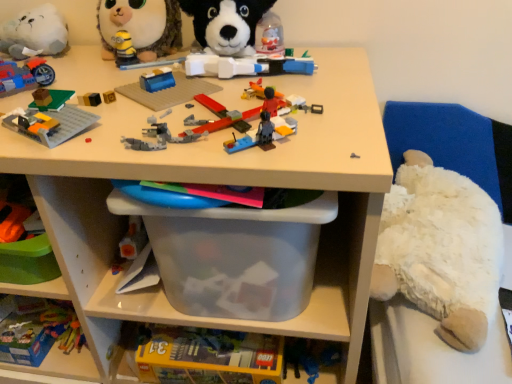
The image size is (512, 384). In order to click on free spot behind matte blue motorcycle at upper left, the 3th toy positioned from the left in this screenshot , I will do `click(36, 54)`.